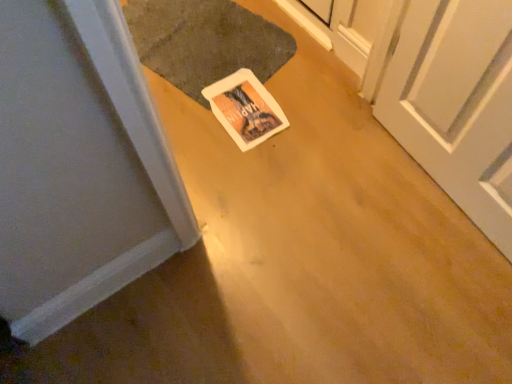
The image size is (512, 384). I want to click on white paper postcard at center, so click(245, 109).

This screenshot has width=512, height=384. Describe the element at coordinates (245, 109) in the screenshot. I see `white paper postcard at center` at that location.

In order to face dark gray textured mat at center, should I rotate leftwards or rightwards?

Rotate left and turn 7.566 degrees.

This screenshot has height=384, width=512. What do you see at coordinates (205, 42) in the screenshot?
I see `dark gray textured mat at center` at bounding box center [205, 42].

At what (x,y) coordinates should I click in order to perform the action: click on dark gray textured mat at center. Please return your answer as a coordinate pair (x, y). Looking at the image, I should click on (205, 42).

Image resolution: width=512 pixels, height=384 pixels. Find the location of `white paper postcard at center`. white paper postcard at center is located at coordinates (245, 109).

Between dark gray textured mat at center and white paper postcard at center, which one appears on the left side from the viewer's perspective?

Positioned to the left is dark gray textured mat at center.

Is dark gray textured mat at center further to the viewer compared to white paper postcard at center?

Yes, the depth of dark gray textured mat at center is greater than that of white paper postcard at center.

Is point (182, 50) closer or farther from the camera than point (232, 79)?

Point (182, 50) is farther from the camera than point (232, 79).

Consider the image. From the image's perspective, is dark gray textured mat at center below white paper postcard at center?

Incorrect, from the image's perspective, dark gray textured mat at center is higher than white paper postcard at center.

In the scene shown: From a real-world perspective, between dark gray textured mat at center and white paper postcard at center, who is vertically lower?

From a 3D spatial view, white paper postcard at center is below.

Which of these two, dark gray textured mat at center or white paper postcard at center, is thinner?

With smaller width is white paper postcard at center.

Between dark gray textured mat at center and white paper postcard at center, which one has less height?

With less height is white paper postcard at center.

Between dark gray textured mat at center and white paper postcard at center, which one has smaller size?

Smaller between the two is white paper postcard at center.

Is white paper postcard at center inside dark gray textured mat at center?

Yes, dark gray textured mat at center is surrounding white paper postcard at center.

Is dark gray textured mat at center with white paper postcard at center?

dark gray textured mat at center is not next to white paper postcard at center, and they're not touching.

Does dark gray textured mat at center turn towards white paper postcard at center?

No, dark gray textured mat at center is not aimed at white paper postcard at center.

What's the angular difference between dark gray textured mat at center and white paper postcard at center's facing directions?

They differ by 105 degrees in their facing directions.

Where is `postcard that appears below the dark gray textured mat at center (from the image's perspective)`? Image resolution: width=512 pixels, height=384 pixels. postcard that appears below the dark gray textured mat at center (from the image's perspective) is located at coordinates (245, 109).

Which object is positioned more to the right, white paper postcard at center or dark gray textured mat at center?

white paper postcard at center.

Is white paper postcard at center further to camera compared to dark gray textured mat at center?

That is False.

Is point (220, 102) in front of point (215, 59)?

That is True.

From the image's perspective, between white paper postcard at center and dark gray textured mat at center, who is located below?

white paper postcard at center appears lower in the image.

From a real-world perspective, is white paper postcard at center positioned above or below dark gray textured mat at center?

white paper postcard at center is situated lower than dark gray textured mat at center in the real world.

Considering the sizes of objects white paper postcard at center and dark gray textured mat at center in the image provided, who is thinner, white paper postcard at center or dark gray textured mat at center?

With smaller width is white paper postcard at center.

Is white paper postcard at center taller or shorter than dark gray textured mat at center?

Considering their sizes, white paper postcard at center has less height than dark gray textured mat at center.

From the picture: Does white paper postcard at center have a larger size compared to dark gray textured mat at center?

No.

In the scene shown: Choose the correct answer: Is white paper postcard at center inside dark gray textured mat at center or outside it?

white paper postcard at center is contained in dark gray textured mat at center.

Can you see white paper postcard at center touching dark gray textured mat at center?

white paper postcard at center is not next to dark gray textured mat at center, and they're not touching.

Is white paper postcard at center oriented towards dark gray textured mat at center?

Yes.

Looking at this image, how different are the orientations of white paper postcard at center and dark gray textured mat at center in degrees?

→ There is a 105-degree angle between the facing directions of white paper postcard at center and dark gray textured mat at center.

Find the location of `doormat behind the white paper postcard at center`. doormat behind the white paper postcard at center is located at coordinates (205, 42).

At what (x,y) coordinates should I click in order to perform the action: click on postcard that is below the dark gray textured mat at center (from the image's perspective). Please return your answer as a coordinate pair (x, y). Image resolution: width=512 pixels, height=384 pixels. Looking at the image, I should click on (245, 109).

You are a GUI agent. You are given a task and a screenshot of the screen. Output one action in this format:
    pyautogui.click(x=<x>, y=<y>)
    Task: Click on the postcard on the right of dark gray textured mat at center
    Image resolution: width=512 pixels, height=384 pixels.
    Given the screenshot: What is the action you would take?
    pyautogui.click(x=245, y=109)